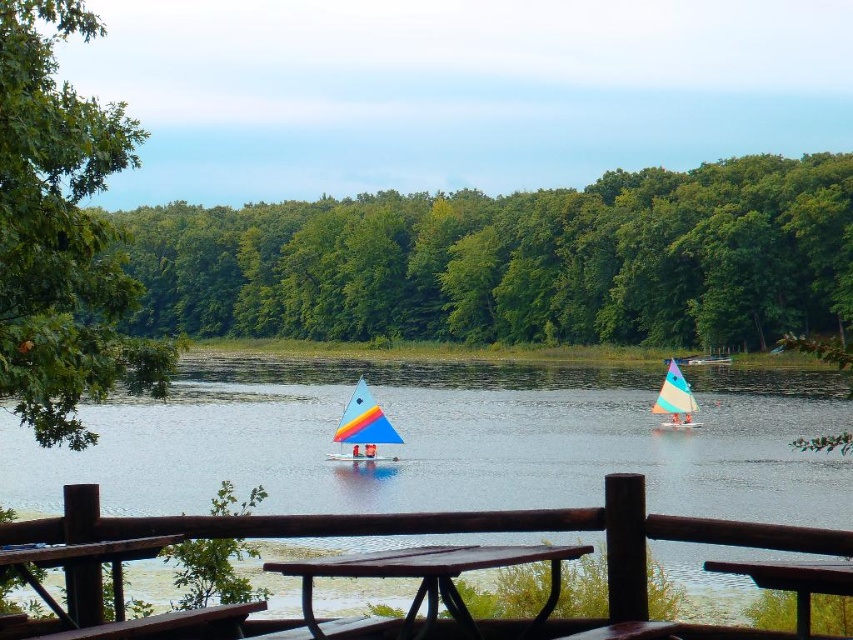
You are sitting at the brown wood picnic table at center and want to look at the transparent plastic water at center. Which direction should you turn your head to see it?

Since the brown wood picnic table at center is behind transparent plastic water at center, you are already facing the transparent plastic water at center, so you don not need to turn your head.

Looking at this image, you are planning to set up a tent in the lakeside area. Considering the green leafy trees at upper center and the green leafy tree at left, which tree would provide more shade for your tent?

The green leafy tree at left would provide more shade for your tent because it is larger in size compared to the green leafy trees at upper center.